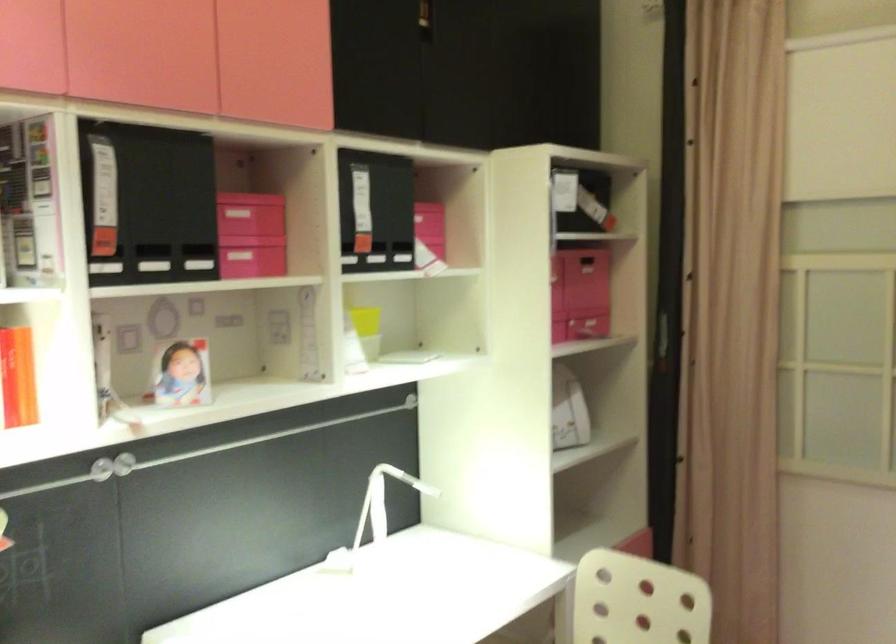
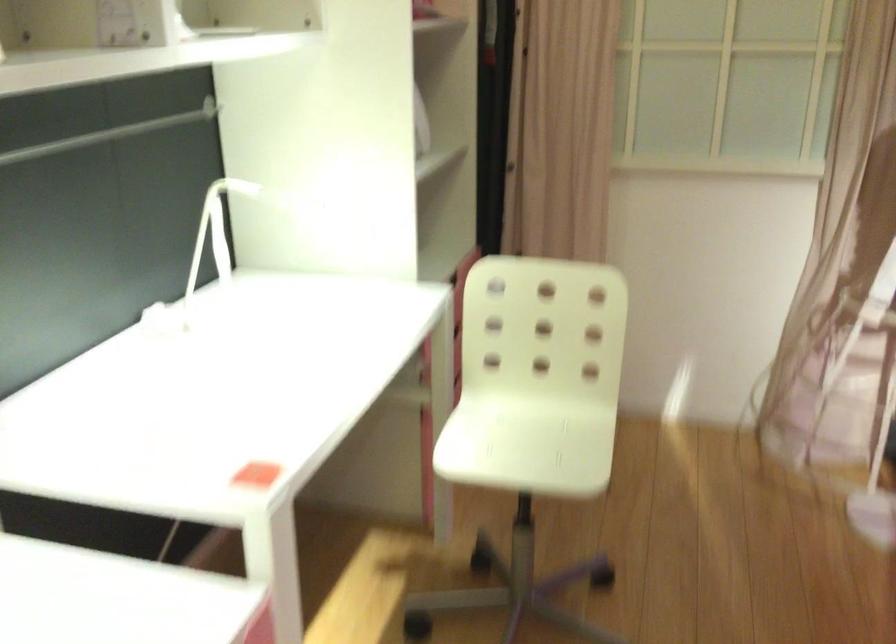
Locate, in the second image, the point that corresponds to pixel 369 502 in the first image.

(213, 234)